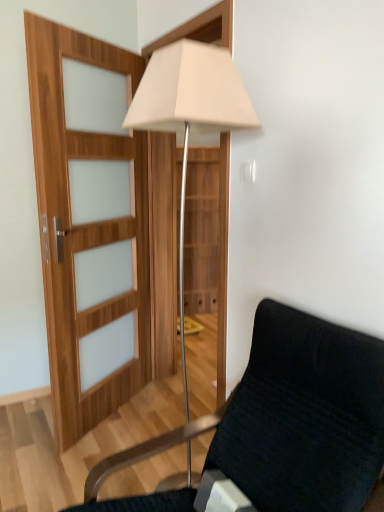
Question: Considering the relative sizes of white fabric lamp at center and velvet black chair at lower right in the image provided, is white fabric lamp at center bigger than velvet black chair at lower right?

Choices:
 (A) yes
 (B) no

Answer: (B)

Question: From the image's perspective, is white fabric lamp at center located above velvet black chair at lower right?

Choices:
 (A) yes
 (B) no

Answer: (A)

Question: Can you confirm if white fabric lamp at center is shorter than velvet black chair at lower right?

Choices:
 (A) yes
 (B) no

Answer: (B)

Question: Considering the relative sizes of white fabric lamp at center and velvet black chair at lower right in the image provided, is white fabric lamp at center wider than velvet black chair at lower right?

Choices:
 (A) yes
 (B) no

Answer: (B)

Question: Considering the relative positions of white fabric lamp at center and velvet black chair at lower right in the image provided, is white fabric lamp at center to the right of velvet black chair at lower right from the viewer's perspective?

Choices:
 (A) no
 (B) yes

Answer: (A)

Question: Are white fabric lamp at center and velvet black chair at lower right far apart?

Choices:
 (A) no
 (B) yes

Answer: (A)

Question: From a real-world perspective, is velvet black chair at lower right located higher than white fabric lamp at center?

Choices:
 (A) no
 (B) yes

Answer: (A)

Question: Is velvet black chair at lower right not close to white fabric lamp at center?

Choices:
 (A) yes
 (B) no

Answer: (B)

Question: Considering the relative positions of velvet black chair at lower right and white fabric lamp at center in the image provided, is velvet black chair at lower right to the right of white fabric lamp at center from the viewer's perspective?

Choices:
 (A) yes
 (B) no

Answer: (A)

Question: Does velvet black chair at lower right have a greater height compared to white fabric lamp at center?

Choices:
 (A) no
 (B) yes

Answer: (A)

Question: Is velvet black chair at lower right facing towards white fabric lamp at center?

Choices:
 (A) yes
 (B) no

Answer: (B)

Question: Is the position of velvet black chair at lower right less distant than that of white fabric lamp at center?

Choices:
 (A) yes
 (B) no

Answer: (A)

Question: Would you say velvet black chair at lower right is inside or outside white fabric lamp at center?

Choices:
 (A) inside
 (B) outside

Answer: (B)